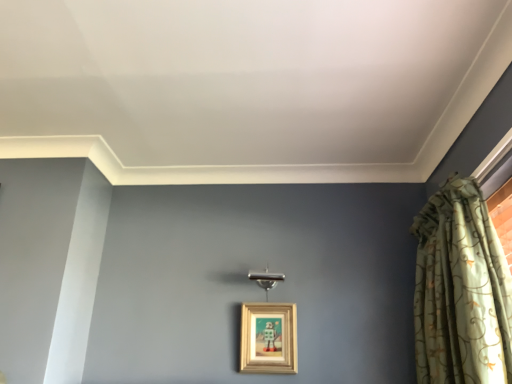
Question: Is green floral fabric curtain at right facing away from wooden frame at center?

Choices:
 (A) no
 (B) yes

Answer: (A)

Question: Is green floral fabric curtain at right shorter than wooden frame at center?

Choices:
 (A) no
 (B) yes

Answer: (A)

Question: Considering the relative positions of green floral fabric curtain at right and wooden frame at center in the image provided, is green floral fabric curtain at right to the right of wooden frame at center from the viewer's perspective?

Choices:
 (A) yes
 (B) no

Answer: (A)

Question: Does green floral fabric curtain at right appear on the left side of wooden frame at center?

Choices:
 (A) no
 (B) yes

Answer: (A)

Question: From the image's perspective, is green floral fabric curtain at right under wooden frame at center?

Choices:
 (A) yes
 (B) no

Answer: (B)

Question: Is green floral fabric curtain at right placed right next to wooden frame at center?

Choices:
 (A) yes
 (B) no

Answer: (B)

Question: Is wooden frame at center shorter than green floral fabric curtain at right?

Choices:
 (A) no
 (B) yes

Answer: (B)

Question: Does wooden frame at center appear on the right side of green floral fabric curtain at right?

Choices:
 (A) no
 (B) yes

Answer: (A)

Question: From a real-world perspective, is wooden frame at center positioned over green floral fabric curtain at right based on gravity?

Choices:
 (A) yes
 (B) no

Answer: (B)

Question: Is green floral fabric curtain at right inside wooden frame at center?

Choices:
 (A) no
 (B) yes

Answer: (A)

Question: Is wooden frame at center closer to camera compared to green floral fabric curtain at right?

Choices:
 (A) no
 (B) yes

Answer: (A)

Question: Is wooden frame at center looking in the opposite direction of green floral fabric curtain at right?

Choices:
 (A) yes
 (B) no

Answer: (B)

Question: In terms of height, does green floral fabric curtain at right look taller or shorter compared to wooden frame at center?

Choices:
 (A) tall
 (B) short

Answer: (A)